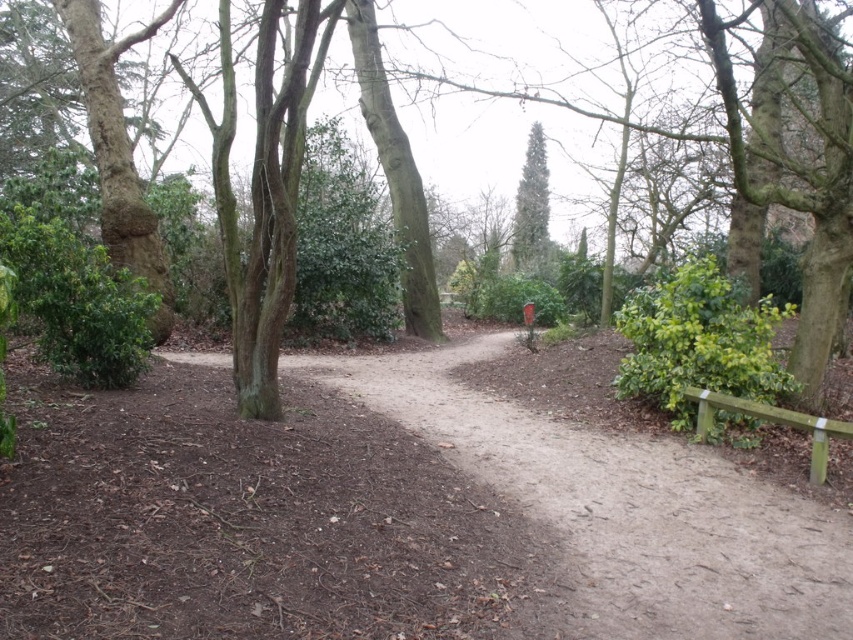
Between green glossy tree at center and green wooden bench at right, which one appears on the right side from the viewer's perspective?

From the viewer's perspective, green glossy tree at center appears more on the right side.

Can you confirm if green glossy tree at center is wider than green wooden bench at right?

Yes.

Image resolution: width=853 pixels, height=640 pixels. What do you see at coordinates (531, 208) in the screenshot?
I see `green glossy tree at center` at bounding box center [531, 208].

This screenshot has height=640, width=853. What are the coordinates of `green glossy tree at center` in the screenshot? It's located at (531, 208).

Based on the photo, which is more to the right, dirt path at center or green wooden bench at right?

From the viewer's perspective, green wooden bench at right appears more on the right side.

Which is above, dirt path at center or green wooden bench at right?

green wooden bench at right is higher up.

Is point (770, 572) positioned after point (811, 426)?

No, (770, 572) is in front of (811, 426).

Find the location of a particular element. Image resolution: width=853 pixels, height=640 pixels. dirt path at center is located at coordinates (624, 506).

Who is more forward, (488, 403) or (521, 198)?

Point (488, 403)

Does dirt path at center appear on the left side of green glossy tree at center?

Correct, you'll find dirt path at center to the left of green glossy tree at center.

Is point (709, 620) closer to viewer compared to point (526, 198)?

Yes, it is in front of point (526, 198).

Where is `dirt path at center`? The height and width of the screenshot is (640, 853). dirt path at center is located at coordinates (624, 506).